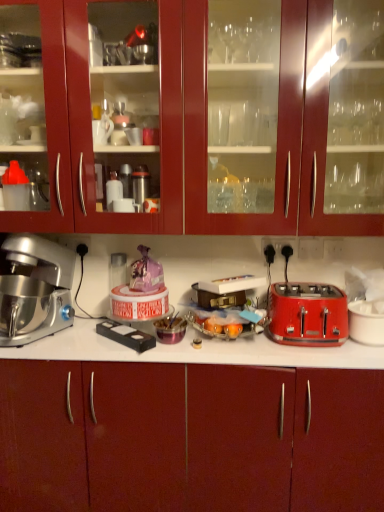
Based on the photo, what is the approximate height of red plastic toaster at right?

red plastic toaster at right is 8.23 inches tall.

In the scene shown: What is the approximate width of silver metallic stand mixer at left?

It is 43.23 centimeters.

Describe the element at coordinates (276, 250) in the screenshot. This screenshot has height=512, width=384. I see `black plastic electrical outlet at upper right` at that location.

What do you see at coordinates (207, 438) in the screenshot? Image resolution: width=384 pixels, height=512 pixels. I see `matte wood cabinet at lower center, placed as the second cabinetry when sorted from top to bottom` at bounding box center [207, 438].

In order to click on black plastic remote control at center in this screenshot , I will do `click(126, 335)`.

Could you tell me if black plastic remote control at center is turned towards matte wood cabinet at lower center, arranged as the first cabinetry when ordered from the bottom?

No, black plastic remote control at center is not turned towards matte wood cabinet at lower center, arranged as the first cabinetry when ordered from the bottom.

Does black plastic remote control at center have a lesser width compared to matte wood cabinet at lower center, arranged as the first cabinetry when ordered from the bottom?

Yes.

Does black plastic remote control at center appear on the left side of matte wood cabinet at lower center, arranged as the first cabinetry when ordered from the bottom?

Indeed, black plastic remote control at center is positioned on the left side of matte wood cabinet at lower center, arranged as the first cabinetry when ordered from the bottom.

Can you confirm if black plastic remote control at center is smaller than matte wood cabinet at lower center, arranged as the first cabinetry when ordered from the bottom?

Indeed, black plastic remote control at center has a smaller size compared to matte wood cabinet at lower center, arranged as the first cabinetry when ordered from the bottom.

Considering the positions of objects black plastic electrical outlet at upper right and glossy wood cabinets at upper center, marked as the 1th cabinetry in a top-to-bottom arrangement, in the image provided, who is behind, black plastic electrical outlet at upper right or glossy wood cabinets at upper center, marked as the 1th cabinetry in a top-to-bottom arrangement,?

black plastic electrical outlet at upper right is further from the camera.

Consider the image. From a real-world perspective, between black plastic electrical outlet at upper right and glossy wood cabinets at upper center, marked as the 1th cabinetry in a top-to-bottom arrangement, who is vertically higher?

From a 3D spatial view, glossy wood cabinets at upper center, marked as the 1th cabinetry in a top-to-bottom arrangement, is above.

Would you say black plastic electrical outlet at upper right is a long distance from glossy wood cabinets at upper center, marked as the 1th cabinetry in a top-to-bottom arrangement?

They are positioned close to each other.

Considering the relative positions of black plastic electrical outlet at upper right and glossy wood cabinets at upper center, the 2th cabinetry from the bottom, in the image provided, is black plastic electrical outlet at upper right to the left or to the right of glossy wood cabinets at upper center, the 2th cabinetry from the bottom,?

Clearly, black plastic electrical outlet at upper right is on the right of glossy wood cabinets at upper center, the 2th cabinetry from the bottom, in the image.

How much distance is there between red plastic toaster at right and glossy wood cabinets at upper center, the 2th cabinetry from the bottom?

The distance of red plastic toaster at right from glossy wood cabinets at upper center, the 2th cabinetry from the bottom, is 22.95 inches.

Considering the points (289, 315) and (169, 201), which point is in front, point (289, 315) or point (169, 201)?

The point (169, 201) is closer.

From the image's perspective, does red plastic toaster at right appear higher than glossy wood cabinets at upper center, marked as the 1th cabinetry in a top-to-bottom arrangement?

No, from the image's perspective, red plastic toaster at right is not over glossy wood cabinets at upper center, marked as the 1th cabinetry in a top-to-bottom arrangement.

Between red plastic toaster at right and glossy wood cabinets at upper center, the 2th cabinetry from the bottom, which one appears on the right side from the viewer's perspective?

red plastic toaster at right is more to the right.

Which is more to the left, matte wood cabinet at lower center, placed as the second cabinetry when sorted from top to bottom, or glossy wood cabinets at upper center, marked as the 1th cabinetry in a top-to-bottom arrangement?

From the viewer's perspective, glossy wood cabinets at upper center, marked as the 1th cabinetry in a top-to-bottom arrangement, appears more on the left side.

From a real-world perspective, is matte wood cabinet at lower center, placed as the second cabinetry when sorted from top to bottom, on top of glossy wood cabinets at upper center, marked as the 1th cabinetry in a top-to-bottom arrangement?

Incorrect, from a real-world perspective, matte wood cabinet at lower center, placed as the second cabinetry when sorted from top to bottom, is lower than glossy wood cabinets at upper center, marked as the 1th cabinetry in a top-to-bottom arrangement.

Is matte wood cabinet at lower center, arranged as the first cabinetry when ordered from the bottom, closer to camera compared to glossy wood cabinets at upper center, marked as the 1th cabinetry in a top-to-bottom arrangement?

No.

Is matte wood cabinet at lower center, arranged as the first cabinetry when ordered from the bottom, spatially inside glossy wood cabinets at upper center, marked as the 1th cabinetry in a top-to-bottom arrangement, or outside of it?

matte wood cabinet at lower center, arranged as the first cabinetry when ordered from the bottom, exists outside the volume of glossy wood cabinets at upper center, marked as the 1th cabinetry in a top-to-bottom arrangement.

From a real-world perspective, which is physically below, black plastic electrical outlet at upper right or silver metallic stand mixer at left?

silver metallic stand mixer at left, from a real-world perspective.

Locate an element on the screen. This screenshot has width=384, height=512. electric outlet above the silver metallic stand mixer at left (from the image's perspective) is located at coordinates (276, 250).

Could you tell me if black plastic electrical outlet at upper right is turned towards silver metallic stand mixer at left?

No, black plastic electrical outlet at upper right does not turn towards silver metallic stand mixer at left.

Is glossy wood cabinets at upper center, the 2th cabinetry from the bottom, closer to the viewer compared to black plastic remote control at center?

Yes, glossy wood cabinets at upper center, the 2th cabinetry from the bottom, is in front of black plastic remote control at center.

From the image's perspective, who appears lower, glossy wood cabinets at upper center, the 2th cabinetry from the bottom, or black plastic remote control at center?

black plastic remote control at center, from the image's perspective.

In terms of width, does glossy wood cabinets at upper center, marked as the 1th cabinetry in a top-to-bottom arrangement, look wider or thinner when compared to black plastic remote control at center?

Clearly, glossy wood cabinets at upper center, marked as the 1th cabinetry in a top-to-bottom arrangement, has more width compared to black plastic remote control at center.

Is matte wood cabinet at lower center, placed as the second cabinetry when sorted from top to bottom, facing away from black plastic electrical outlet at upper right?

No, matte wood cabinet at lower center, placed as the second cabinetry when sorted from top to bottom, is not facing away from black plastic electrical outlet at upper right.

Considering the relative sizes of matte wood cabinet at lower center, arranged as the first cabinetry when ordered from the bottom, and black plastic electrical outlet at upper right in the image provided, is matte wood cabinet at lower center, arranged as the first cabinetry when ordered from the bottom, bigger than black plastic electrical outlet at upper right?

Indeed, matte wood cabinet at lower center, arranged as the first cabinetry when ordered from the bottom, has a larger size compared to black plastic electrical outlet at upper right.

How many degrees apart are the facing directions of matte wood cabinet at lower center, arranged as the first cabinetry when ordered from the bottom, and black plastic electrical outlet at upper right?

1.59 degrees.

What are the coordinates of `cabinetry below the black plastic remote control at center (from the image's perspective)` in the screenshot? It's located at (207, 438).

In order to click on cabinetry lying above the black plastic electrical outlet at upper right (from the image's perspective) in this screenshot , I will do `click(209, 123)`.

From the image, which object appears to be nearer to glossy wood cabinets at upper center, the 2th cabinetry from the bottom, red plastic toaster at right or silver metallic stand mixer at left?

silver metallic stand mixer at left.

Estimate the real-world distances between objects in this image. Which object is further from red plastic toaster at right, silver metallic stand mixer at left or matte wood cabinet at lower center, placed as the second cabinetry when sorted from top to bottom?

The object further to red plastic toaster at right is silver metallic stand mixer at left.

When comparing their distances from matte wood cabinet at lower center, arranged as the first cabinetry when ordered from the bottom, does silver metallic stand mixer at left or red plastic toaster at right seem further?

silver metallic stand mixer at left lies further to matte wood cabinet at lower center, arranged as the first cabinetry when ordered from the bottom, than the other object.

When comparing their distances from black plastic remote control at center, does red plastic toaster at right or black plastic electrical outlet at upper right seem further?

black plastic electrical outlet at upper right.

Looking at this image, estimate the real-world distances between objects in this image. Which object is further from red plastic toaster at right, black plastic remote control at center or black plastic electrical outlet at upper right?

Among the two, black plastic remote control at center is located further to red plastic toaster at right.

Based on their spatial positions, is matte wood cabinet at lower center, placed as the second cabinetry when sorted from top to bottom, or black plastic remote control at center further from black plastic electrical outlet at upper right?

The object further to black plastic electrical outlet at upper right is matte wood cabinet at lower center, placed as the second cabinetry when sorted from top to bottom.

Which object lies further to the anchor point black plastic electrical outlet at upper right, matte wood cabinet at lower center, placed as the second cabinetry when sorted from top to bottom, or glossy wood cabinets at upper center, marked as the 1th cabinetry in a top-to-bottom arrangement?

matte wood cabinet at lower center, placed as the second cabinetry when sorted from top to bottom, lies further to black plastic electrical outlet at upper right than the other object.

Estimate the real-world distances between objects in this image. Which object is further from black plastic electrical outlet at upper right, black plastic remote control at center or matte wood cabinet at lower center, arranged as the first cabinetry when ordered from the bottom?

matte wood cabinet at lower center, arranged as the first cabinetry when ordered from the bottom.

This screenshot has width=384, height=512. What are the coordinates of `electric outlet between black plastic remote control at center and red plastic toaster at right` in the screenshot? It's located at (276, 250).

Locate an element on the screen. The image size is (384, 512). toaster between glossy wood cabinets at upper center, marked as the 1th cabinetry in a top-to-bottom arrangement, and matte wood cabinet at lower center, arranged as the first cabinetry when ordered from the bottom, in the up-down direction is located at coordinates (308, 314).

Where is `toaster between black plastic electrical outlet at upper right and matte wood cabinet at lower center, placed as the second cabinetry when sorted from top to bottom, vertically`? The height and width of the screenshot is (512, 384). toaster between black plastic electrical outlet at upper right and matte wood cabinet at lower center, placed as the second cabinetry when sorted from top to bottom, vertically is located at coordinates (308, 314).

This screenshot has width=384, height=512. I want to click on appliance between silver metallic stand mixer at left and black plastic electrical outlet at upper right from left to right, so click(x=126, y=335).